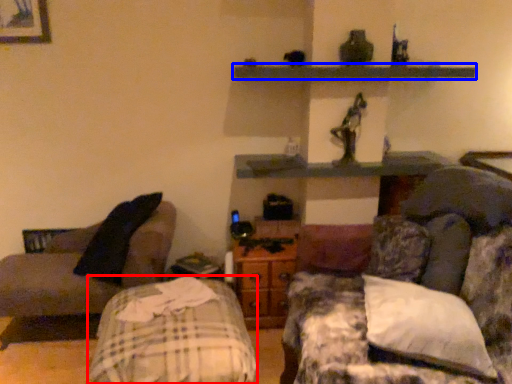
Question: Which point is closer to the camera, bed frame (highlighted by a red box) or shelf (highlighted by a blue box)?

Choices:
 (A) bed frame
 (B) shelf

Answer: (A)